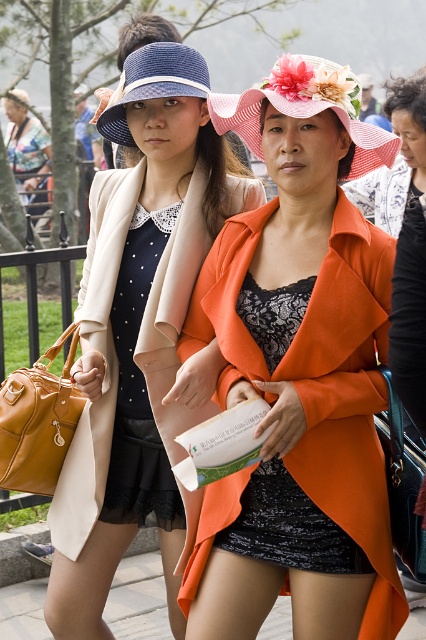
You are a photographer trying to capture a clear shot of the blue woven hat at upper center. However, the black lace dress at center is blocking your view. Can you adjust your position to see the hat without moving the subjects?

The black lace dress at center is in front of the blue woven hat at upper center, so you can move your position slightly to the side to see the hat without moving the subjects.

You are a photographer trying to capture a closeup of the pink straw hat at center. However, the orange matte coat at center is blocking your view. Can you still take the photo without moving the objects?

The orange matte coat at center is further to the viewer than the pink straw hat at center, so it is blocking the view. Therefore, you cannot take a clear photo of the pink straw hat at center without moving the orange matte coat at center.

You are a photographer trying to capture both the black lace dress at center and the blue woven hat at upper center in a single frame. Which object should you focus on first to ensure both are in the frame?

The black lace dress at center is smaller than the blue woven hat at upper center, so you should focus on the blue woven hat at upper center first to ensure both are in the frame.